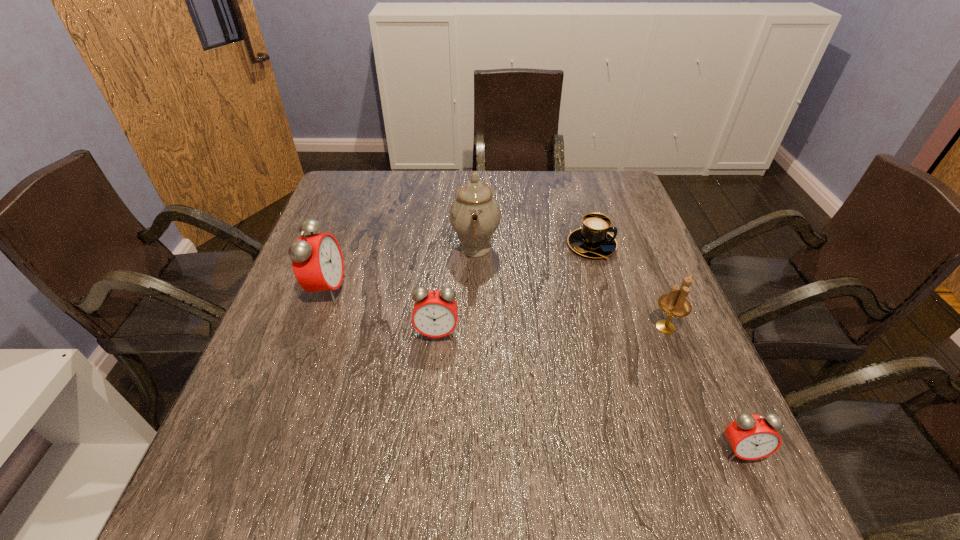
Identify the location of object at the near right corner. The width and height of the screenshot is (960, 540). (751, 437).

In the image, there is a desktop. Where is `vacant area at the far edge`? The width and height of the screenshot is (960, 540). vacant area at the far edge is located at coordinates (390, 184).

At what (x,y) coordinates should I click in order to perform the action: click on vacant region at the near edge of the desktop. Please return your answer as a coordinate pair (x, y). The image size is (960, 540). Looking at the image, I should click on (602, 451).

Where is `blank space at the left edge`? The height and width of the screenshot is (540, 960). blank space at the left edge is located at coordinates (284, 336).

At what (x,y) coordinates should I click in order to perform the action: click on vacant area at the far left corner of the desktop. Please return your answer as a coordinate pair (x, y). This screenshot has width=960, height=540. Looking at the image, I should click on (377, 190).

Locate an element on the screen. free space at the near left corner is located at coordinates (260, 427).

You are a GUI agent. You are given a task and a screenshot of the screen. Output one action in this format:
    pyautogui.click(x=<x>, y=<y>)
    Task: Click on the vacant space at the far right corner of the desktop
    
    Given the screenshot: What is the action you would take?
    pyautogui.click(x=625, y=200)

Identify the location of vacant area that lies between the candle holder and the shortest alarm clock. (703, 389).

The width and height of the screenshot is (960, 540). Find the location of `vacant point located between the candle holder and the tallest object`. vacant point located between the candle holder and the tallest object is located at coordinates (570, 287).

Identify the location of vacant region between the leftmost object and the chinaware. (401, 268).